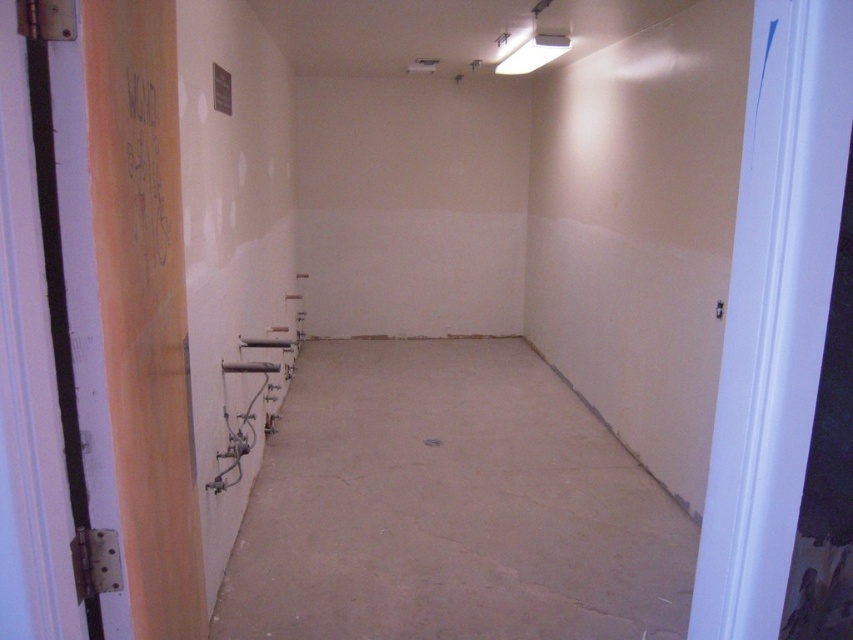
Between smooth concrete floor at center and orange matte door at left, which one appears on the right side from the viewer's perspective?

smooth concrete floor at center

Is smooth concrete floor at center shorter than orange matte door at left?

Yes, smooth concrete floor at center is shorter than orange matte door at left.

Does point (442, 442) come farther from viewer compared to point (146, 474)?

Yes.

Identify the location of smooth concrete floor at center. The height and width of the screenshot is (640, 853). (450, 508).

What do you see at coordinates (450, 508) in the screenshot? The image size is (853, 640). I see `smooth concrete floor at center` at bounding box center [450, 508].

Between point (454, 586) and point (848, 99), which one is positioned in front?

Point (848, 99) is in front.

Does point (654, 621) come farther from viewer compared to point (784, 58)?

Yes, it is.

In order to click on smooth concrete floor at center in this screenshot , I will do `click(450, 508)`.

Which of these two, white glossy door at right or orange matte door at left, stands shorter?

white glossy door at right is shorter.

Describe the element at coordinates (775, 312) in the screenshot. This screenshot has width=853, height=640. I see `white glossy door at right` at that location.

Does point (743, 637) lie in front of point (158, 252)?

That is True.

The height and width of the screenshot is (640, 853). Identify the location of white glossy door at right. (775, 312).